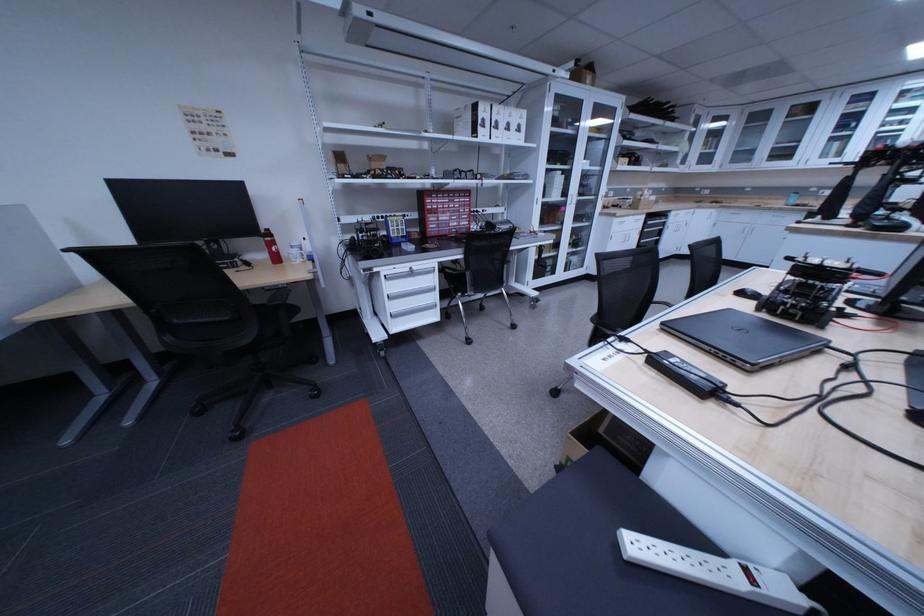
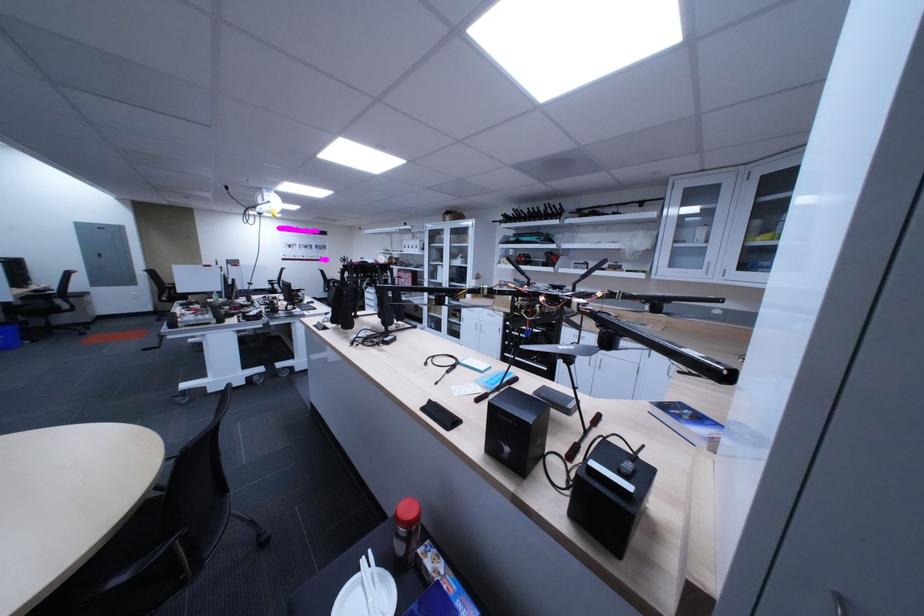
Find the pixel in the second image that matches pixel 626 241 in the first image.

(478, 323)